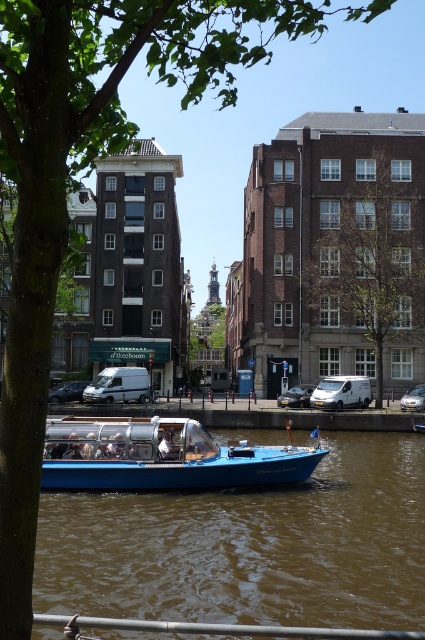
Does point (387, 561) come in front of point (229, 449)?

Yes.

Does blue plastic boat at lower center have a lesser width compared to blue glossy boat at center?

No, blue plastic boat at lower center is not thinner than blue glossy boat at center.

At what (x,y) coordinates should I click in order to perform the action: click on blue plastic boat at lower center. Please return your answer as a coordinate pair (x, y). This screenshot has width=425, height=640. Looking at the image, I should click on (249, 547).

Does point (306, 211) lie in front of point (68, 440)?

No, it is behind (68, 440).

Is point (379, 346) in front of point (238, 456)?

No, (379, 346) is behind (238, 456).

Locate an element on the screen. green leafy tree at center is located at coordinates (365, 262).

Does point (373, 445) come behind point (422, 324)?

No, it is in front of (422, 324).

Locate an element on the screen. The height and width of the screenshot is (640, 425). blue plastic boat at lower center is located at coordinates (249, 547).